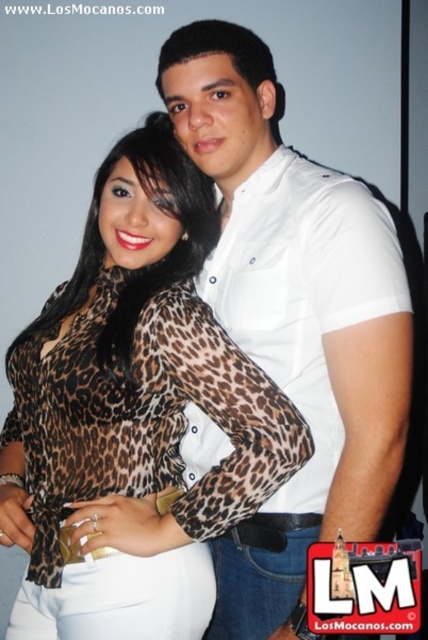
You are a photographer trying to adjust the lighting for a photo shoot. You notice the leopard print blouse at center and the white smooth shirt at center. Which clothing item should you focus on adjusting the lighting for if you want to ensure the details of the frontmost garment are properly lit?

The leopard print blouse at center is the frontmost garment since the white smooth shirt at center is behind it. Therefore, you should focus on adjusting the lighting for the leopard print blouse at center to ensure its details are properly lit.

From the picture: You are a photographer standing at a specific position. You want to capture a closeup shot of the leopard print blouse at center. Given that your camera has a minimum focusing distance of 1 meter, will you be able to take the photo without moving closer?

The leopard print blouse at center is 1.05 meters away from the camera, which is just beyond the minimum focusing distance of 1 meter. Therefore, you will need to move slightly closer to capture the closeup shot.

You are a photographer trying to frame a shot where both the leopard print blouse at center and the white smooth shirt at center are visible. Given their sizes, which clothing item will require more horizontal space in the frame?

The leopard print blouse at center requires more horizontal space in the frame because its width is larger than the white smooth shirt at center.